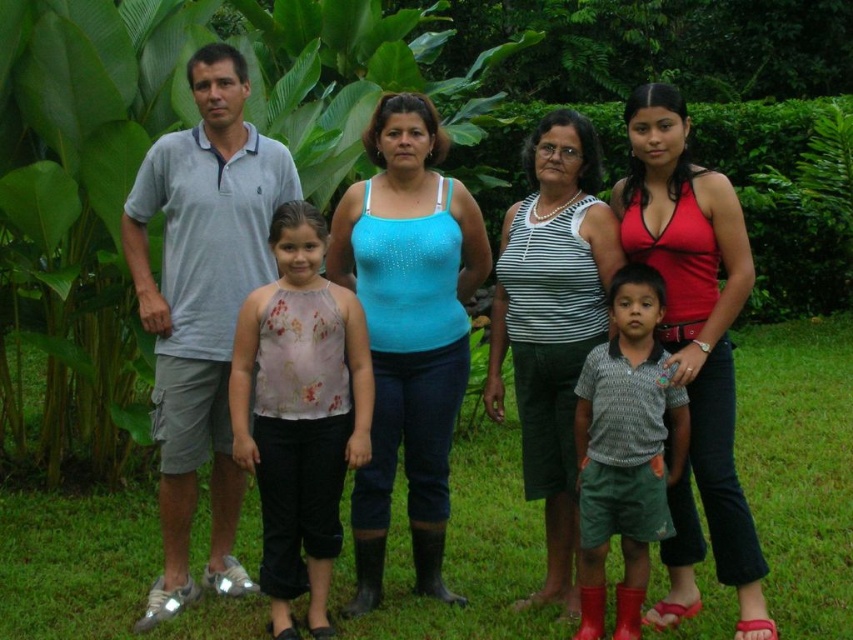
Question: Does green grass at center appear over floral-patterned fabric top at center?

Choices:
 (A) yes
 (B) no

Answer: (B)

Question: In this image, where is matte red tank top at right located relative to textured gray shirt at center?

Choices:
 (A) below
 (B) above

Answer: (B)

Question: Observing the image, what is the correct spatial positioning of gray cotton polo shirt at left in reference to blue sparkly tank top at center?

Choices:
 (A) right
 (B) left

Answer: (B)

Question: Considering the real-world distances, which object is closest to the striped tank top at center?

Choices:
 (A) matte red tank top at right
 (B) matte gray shirt at left
 (C) blue sparkly tank top at center
 (D) textured gray shirt at center

Answer: (B)

Question: Which of these objects is positioned farthest from the striped tank top at center?

Choices:
 (A) green grass at center
 (B) matte gray shirt at left
 (C) blue sparkly tank top at center

Answer: (A)

Question: Which of the following is the closest to the observer?

Choices:
 (A) green grass at center
 (B) blue sparkly tank top at center

Answer: (A)